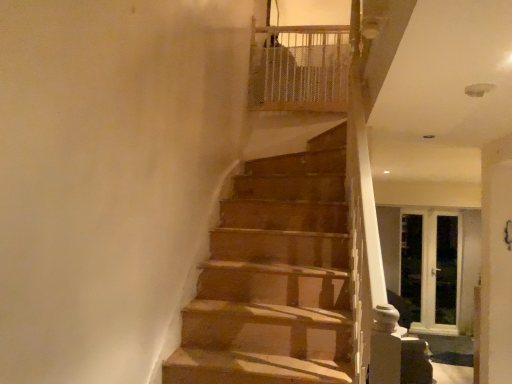
Question: Does white glass screen door at right, the first screen door in the right-to-left sequence, have a lesser width compared to white wooden screen door at right, positioned as the second screen door in left-to-right order?

Choices:
 (A) no
 (B) yes

Answer: (A)

Question: Is white glass screen door at right, arranged as the third screen door when viewed from the left, turned away from white wooden screen door at right, which is the 2th screen door from right to left?

Choices:
 (A) yes
 (B) no

Answer: (A)

Question: Does white glass screen door at right, arranged as the third screen door when viewed from the left, have a greater height compared to white wooden screen door at right, positioned as the second screen door in left-to-right order?

Choices:
 (A) yes
 (B) no

Answer: (A)

Question: Is white glass screen door at right, the first screen door in the right-to-left sequence, bigger than white wooden screen door at right, positioned as the second screen door in left-to-right order?

Choices:
 (A) no
 (B) yes

Answer: (A)

Question: Is white glass screen door at right, the first screen door in the right-to-left sequence, located outside white wooden screen door at right, which is the 2th screen door from right to left?

Choices:
 (A) no
 (B) yes

Answer: (A)

Question: From the image's perspective, is white mesh balustrade at upper center above or below white glass screen door at right, the first screen door in the right-to-left sequence?

Choices:
 (A) below
 (B) above

Answer: (B)

Question: Is point (309, 52) positioned closer to the camera than point (454, 278)?

Choices:
 (A) closer
 (B) farther

Answer: (A)

Question: Is white mesh balustrade at upper center in front of or behind white glass screen door at right, arranged as the third screen door when viewed from the left, in the image?

Choices:
 (A) front
 (B) behind

Answer: (A)

Question: Considering the relative positions of white mesh balustrade at upper center and white glass screen door at right, arranged as the third screen door when viewed from the left, in the image provided, is white mesh balustrade at upper center to the left or to the right of white glass screen door at right, arranged as the third screen door when viewed from the left,?

Choices:
 (A) left
 (B) right

Answer: (A)

Question: Is white wooden screen door at right, positioned as the second screen door in left-to-right order, situated inside clear glass screen door at right, acting as the 3th screen door starting from the right, or outside?

Choices:
 (A) outside
 (B) inside

Answer: (B)

Question: In the image, is white wooden screen door at right, which is the 2th screen door from right to left, on the left side or the right side of clear glass screen door at right, acting as the 3th screen door starting from the right?

Choices:
 (A) left
 (B) right

Answer: (B)

Question: From the image's perspective, relative to clear glass screen door at right, which ranks as the 1th screen door in left-to-right order, is white wooden screen door at right, positioned as the second screen door in left-to-right order, above or below?

Choices:
 (A) below
 (B) above

Answer: (A)

Question: Is white wooden screen door at right, which is the 2th screen door from right to left, in front of or behind clear glass screen door at right, which ranks as the 1th screen door in left-to-right order, in the image?

Choices:
 (A) front
 (B) behind

Answer: (A)

Question: From a real-world perspective, relative to white glass screen door at right, the first screen door in the right-to-left sequence, is white wooden screen door at right, which is the 2th screen door from right to left, vertically above or below?

Choices:
 (A) above
 (B) below

Answer: (B)

Question: In the image, is white wooden screen door at right, which is the 2th screen door from right to left, positioned in front of or behind white glass screen door at right, the first screen door in the right-to-left sequence?

Choices:
 (A) front
 (B) behind

Answer: (B)